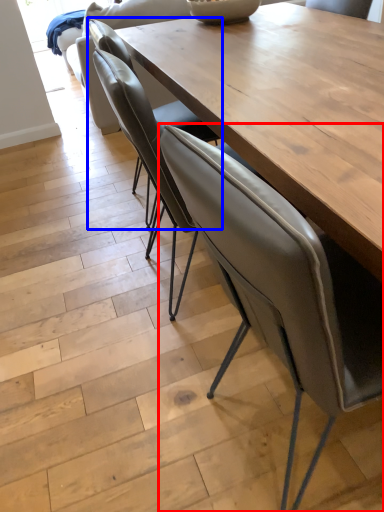
Question: Which object is closer to the camera taking this photo, chair (highlighted by a red box) or chair (highlighted by a blue box)?

Choices:
 (A) chair
 (B) chair

Answer: (A)